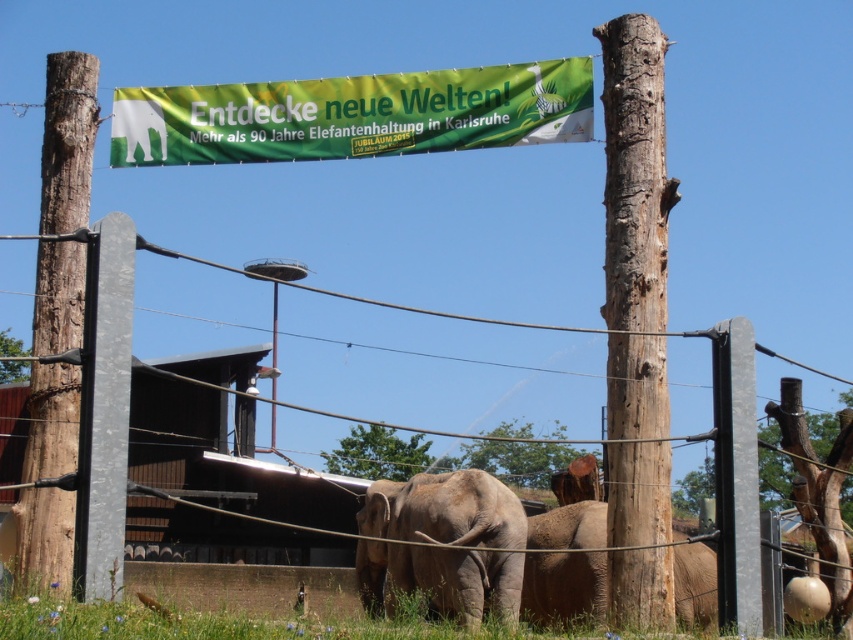
Can you confirm if gray matte elephant at center is positioned to the right of gray matte elephant at lower right?

In fact, gray matte elephant at center is to the left of gray matte elephant at lower right.

What do you see at coordinates (444, 509) in the screenshot? The height and width of the screenshot is (640, 853). I see `gray matte elephant at center` at bounding box center [444, 509].

Which is behind, point (502, 611) or point (578, 577)?

Positioned behind is point (578, 577).

Locate an element on the screen. gray matte elephant at center is located at coordinates (444, 509).

Is brown rough wood pole at left positioned before green grass at lower center?

No, brown rough wood pole at left is further to the viewer.

Is brown rough wood pole at left below green grass at lower center?

Actually, brown rough wood pole at left is above green grass at lower center.

Is point (39, 413) closer to viewer compared to point (341, 632)?

That is False.

I want to click on brown rough wood pole at left, so click(x=67, y=140).

Does green grass at lower center lie in front of gray matte elephant at center?

Yes, green grass at lower center is closer to the viewer.

Between point (267, 568) and point (413, 538), which one is positioned in front?

Point (413, 538)

Measure the distance between point (x=280, y=611) and camera.

Point (x=280, y=611) is 43.41 meters from camera.

The width and height of the screenshot is (853, 640). In order to click on green grass at lower center in this screenshot , I will do `click(228, 608)`.